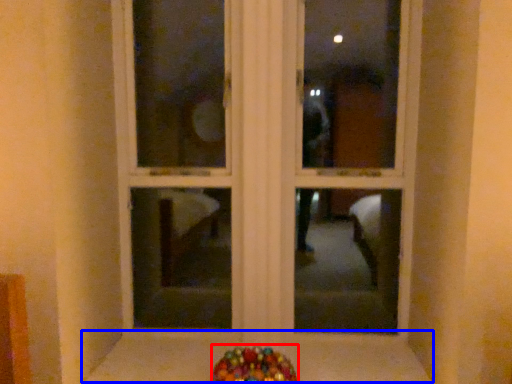
Question: Which object is further to the camera taking this photo, candy (highlighted by a red box) or window sill (highlighted by a blue box)?

Choices:
 (A) candy
 (B) window sill

Answer: (B)